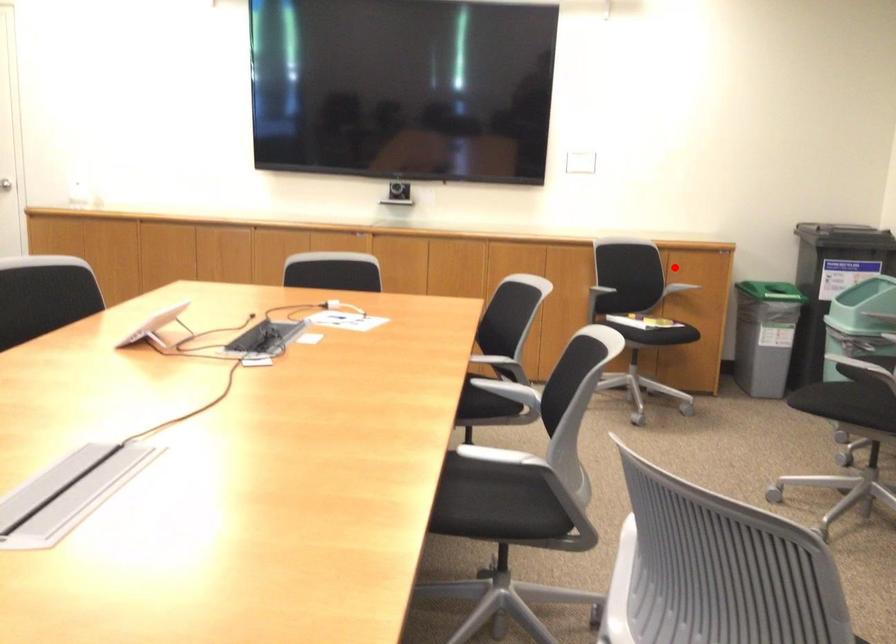
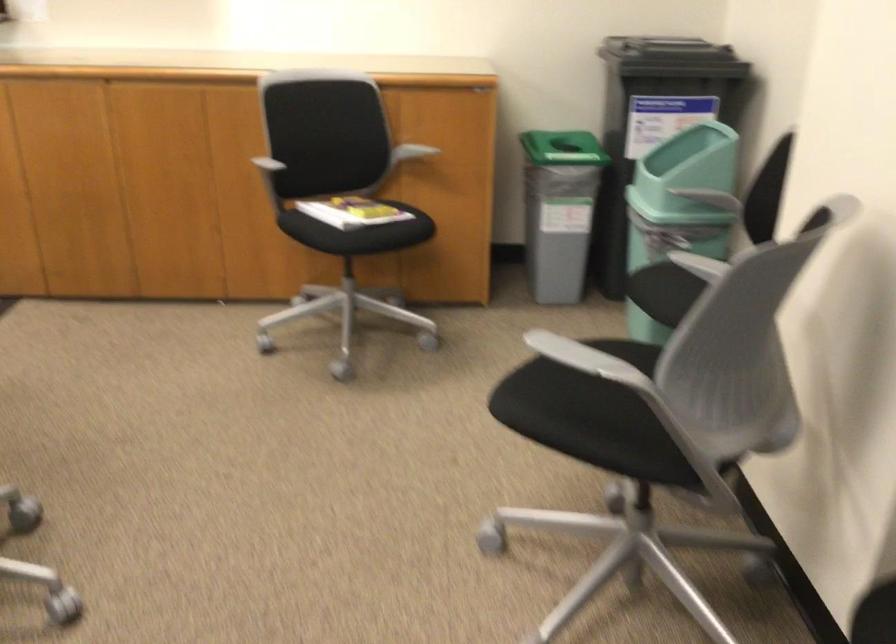
Question: I am providing you with two images of the same scene from different viewpoints. A red point is shown in image1. For the corresponding object point in image2, is it positioned nearer or farther from the camera?

Choices:
 (A) Nearer
 (B) Farther

Answer: (A)